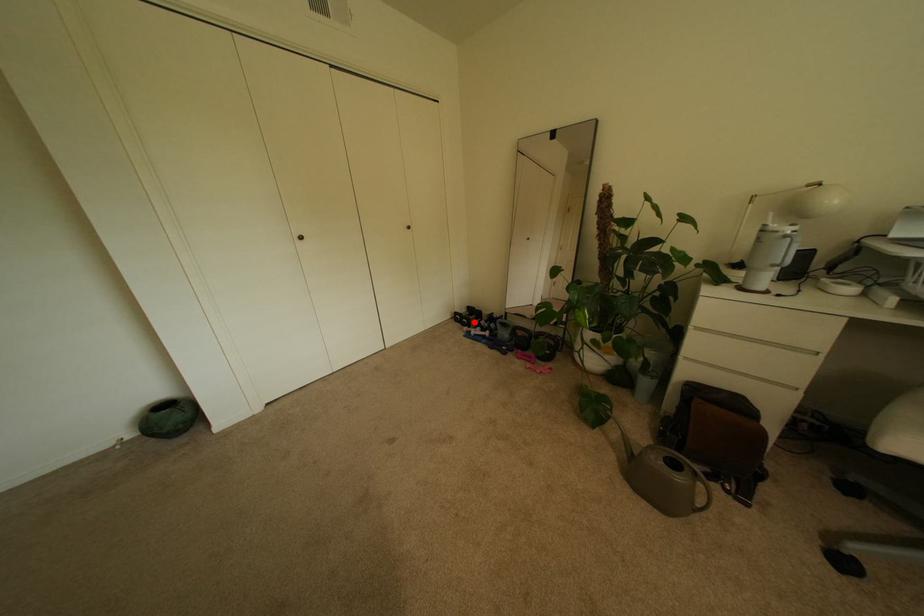
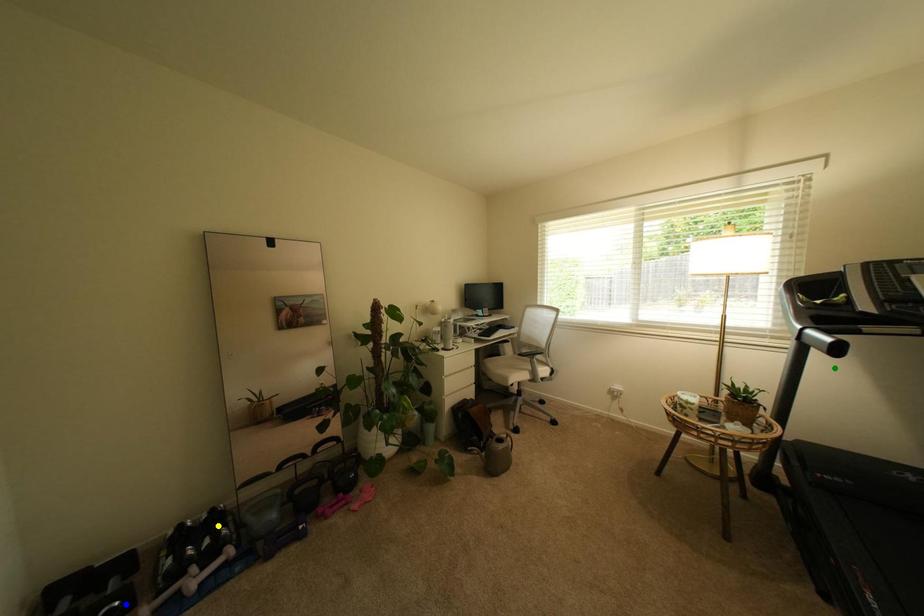
Question: I am providing you with two images of the same scene from different viewpoints. A red point is marked on the first image. You are given multiple points on the second image. Can you choose the point in image 2 that corresponds to the point in image 1?

Choices:
 (A) blue point
 (B) yellow point
 (C) green point

Answer: (A)